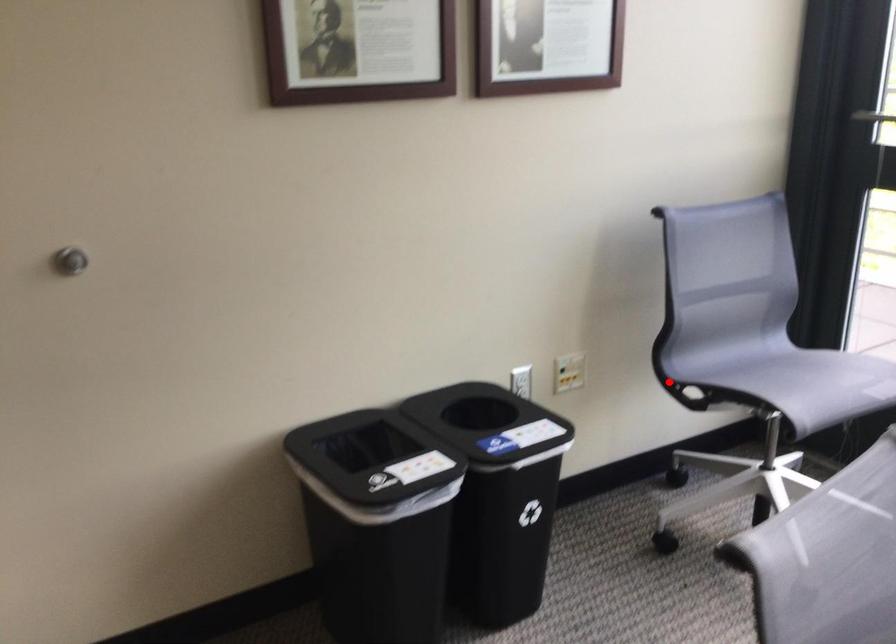
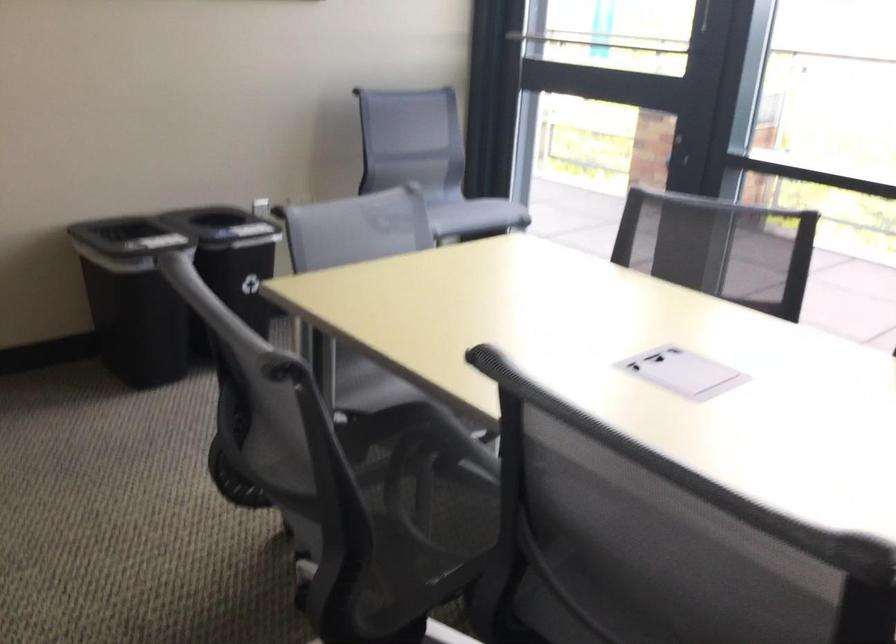
Question: I am providing you with two images of the same scene from different viewpoints. A red point is marked on the first image. At the location where the point appears in image 1, is it still visible in image 2?

Choices:
 (A) Yes
 (B) No

Answer: (B)